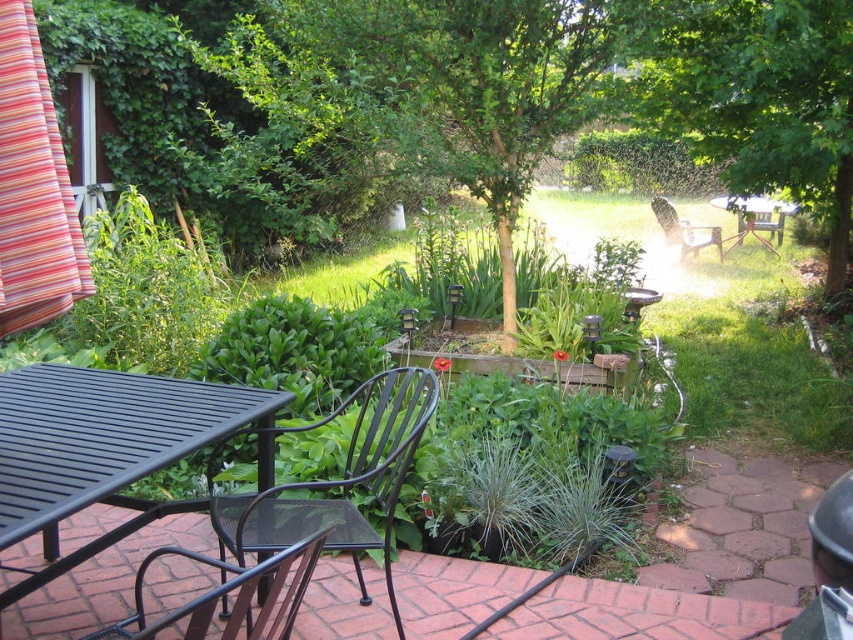
You are planning to place a large decorative pot that is wider than the black metal table at lower left. Where should you place it to ensure it fits within the space occupied by the green leafy tree at center?

The green leafy tree at center is wider than the black metal table at lower left, so placing the large decorative pot within the space of the green leafy tree at center would accommodate its width.

You are planning to place a large potted plant in the backyard garden. The potted plant is as big as the green leafy tree at center. Will it fit in the space where the black mesh chair at lower left currently is?

The green leafy tree at center is larger in size than the black mesh chair at lower left. Since the potted plant is as big as the green leafy tree at center, it will not fit in the space where the black mesh chair at lower left is currently placed because the tree is bigger than the chair, implying the chair area is smaller.